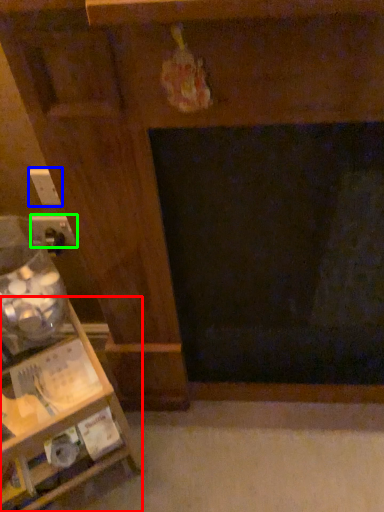
Question: Which object is the farthest from furniture (highlighted by a red box)? Choose among these: electric outlet (highlighted by a blue box) or electric outlet (highlighted by a green box).

Choices:
 (A) electric outlet
 (B) electric outlet

Answer: (A)